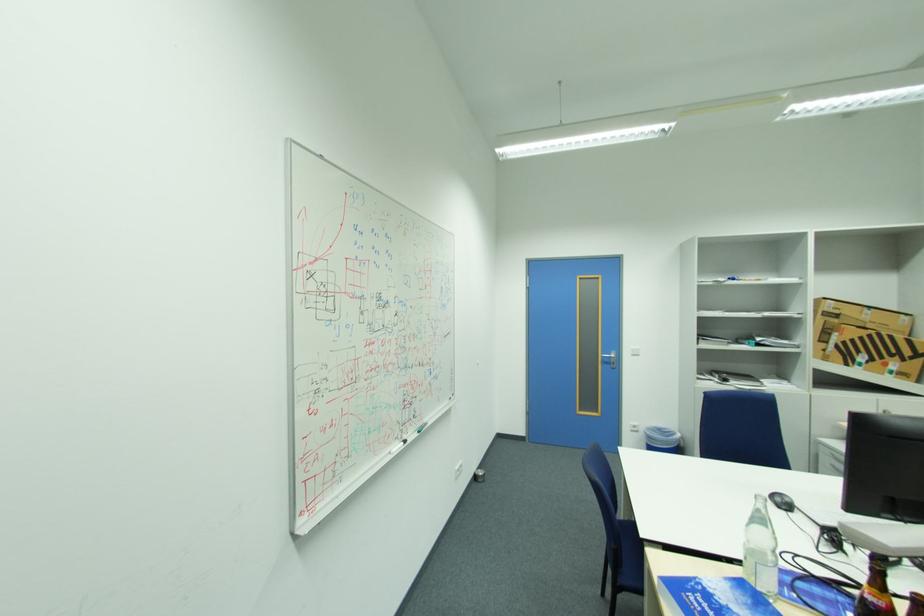
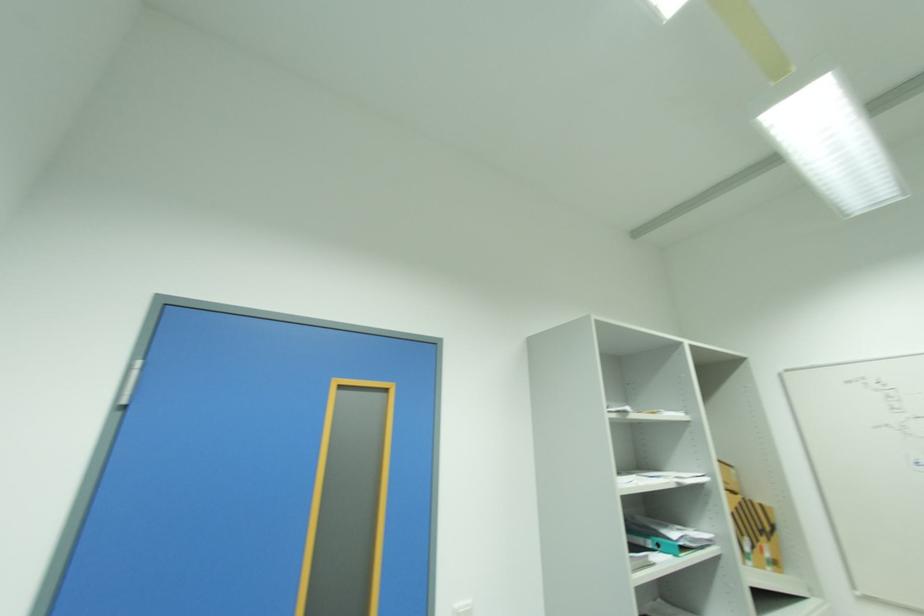
In the second image, find the point that corresponds to the point at 874,337 in the first image.

(746, 506)